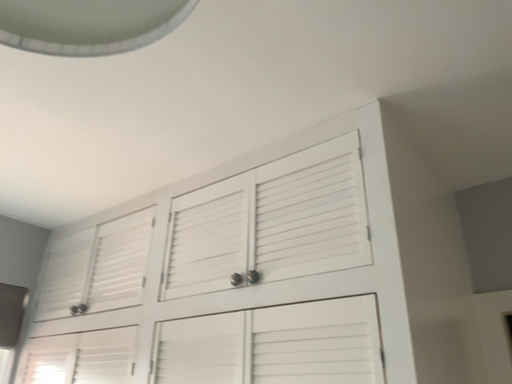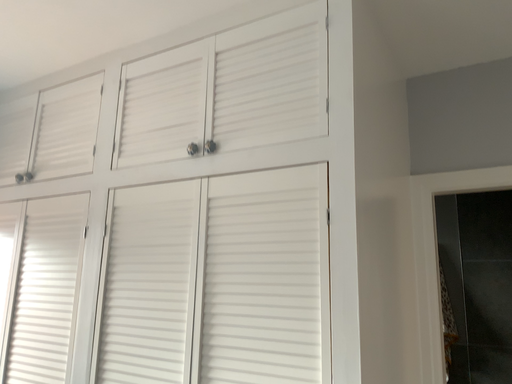
Question: How did the camera likely rotate when shooting the video?

Choices:
 (A) rotated right
 (B) rotated left

Answer: (A)